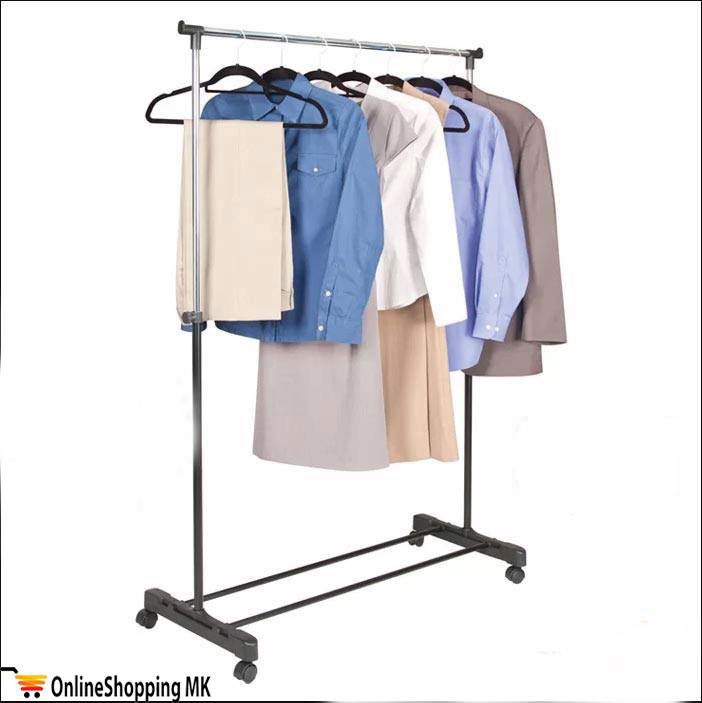
The width and height of the screenshot is (702, 703). What are the coordinates of `hangers` in the screenshot? It's located at (239, 51), (281, 51), (319, 57), (356, 55), (392, 58), (425, 62), (461, 63).